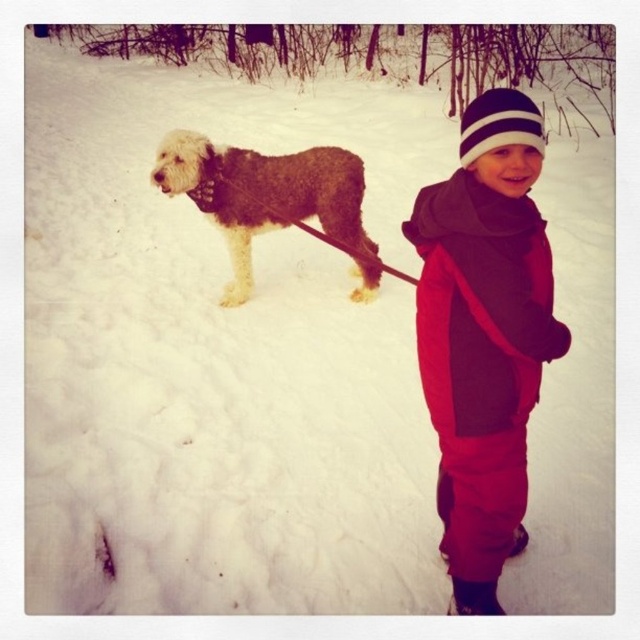
You are a photographer trying to capture a closeup of the child in this winter scene. You want to ensure both the red fleece jacket at center and the white striped knit hat at upper center are clearly visible in the photo. Given their sizes, which object should you focus on first to ensure clarity?

The red fleece jacket at center should be focused on first because it has a larger size compared to the white striped knit hat at upper center, ensuring it remains sharp while the smaller hat will still be in focus due to its proximity.

You are a photographer trying to capture a photo of the fuzzy brown dog at center and the white striped knit hat at upper center. If the camera frame can only fit objects up to 1 meter wide, will both objects fit in the frame together?

The fuzzy brown dog at center might be wider than white striped knit hat at upper center, so it is uncertain if both will fit within the 1 meter width constraint. The photographer should check the combined width of both objects to ensure they fit within the frame.